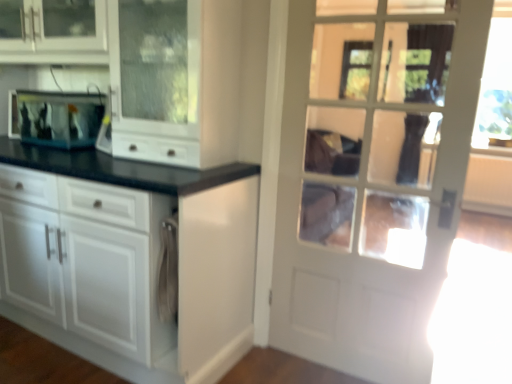
Question: From the image's perspective, does clear glass fish tank at left appear lower than white glass door at upper right?

Choices:
 (A) no
 (B) yes

Answer: (A)

Question: From the image's perspective, is clear glass fish tank at left over white glass door at upper right?

Choices:
 (A) no
 (B) yes

Answer: (B)

Question: Is clear glass fish tank at left looking in the opposite direction of white glass door at upper right?

Choices:
 (A) no
 (B) yes

Answer: (A)

Question: Does clear glass fish tank at left have a larger size compared to white glass door at upper right?

Choices:
 (A) no
 (B) yes

Answer: (A)

Question: Is the depth of clear glass fish tank at left less than that of white glass door at upper right?

Choices:
 (A) yes
 (B) no

Answer: (B)

Question: Could white glass door at upper right be considered to be inside clear glass fish tank at left?

Choices:
 (A) yes
 (B) no

Answer: (B)

Question: Would you say white glossy cabinet at center is a long distance from white glass door at upper right?

Choices:
 (A) no
 (B) yes

Answer: (A)

Question: Is white glossy cabinet at center smaller than white glass door at upper right?

Choices:
 (A) no
 (B) yes

Answer: (A)

Question: Is white glossy cabinet at center placed right next to white glass door at upper right?

Choices:
 (A) no
 (B) yes

Answer: (A)

Question: Is white glossy cabinet at center wider than white glass door at upper right?

Choices:
 (A) yes
 (B) no

Answer: (A)

Question: From the image's perspective, is white glossy cabinet at center on top of white glass door at upper right?

Choices:
 (A) yes
 (B) no

Answer: (A)

Question: Can you confirm if white glossy cabinet at center is thinner than white glass door at upper right?

Choices:
 (A) no
 (B) yes

Answer: (A)

Question: Is white glass door at upper right located outside white glossy cabinet at center?

Choices:
 (A) no
 (B) yes

Answer: (B)